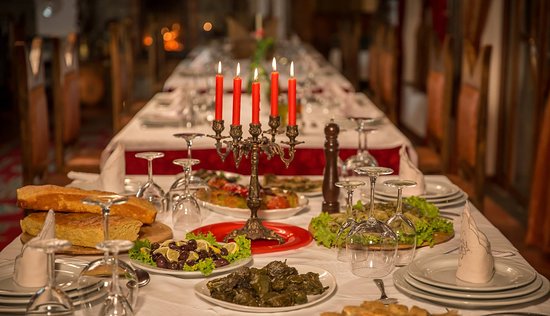
The image size is (550, 316). Find the location of `red plate`. red plate is located at coordinates (297, 237).